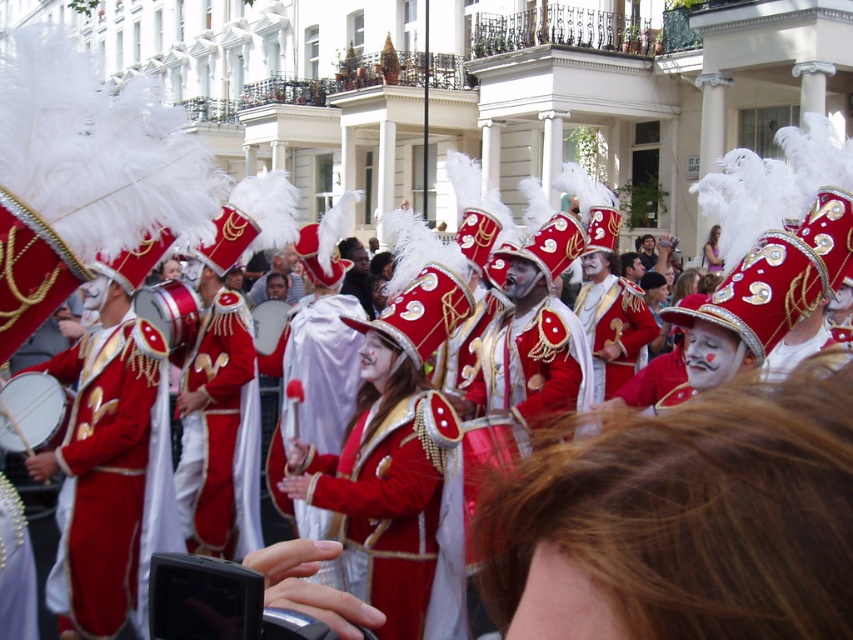
Who is lower down, shiny red coat at center or shiny red fabric at center?

shiny red coat at center

Does point (347, 504) come closer to viewer compared to point (227, 413)?

That is True.

The height and width of the screenshot is (640, 853). In order to click on shiny red coat at center in this screenshot , I will do `click(392, 454)`.

Where is `shiny red fabric at center`? shiny red fabric at center is located at coordinates (219, 433).

Between point (257, 468) and point (714, 260), which one is positioned behind?

The point (714, 260) is behind.

From the picture: Who is more distant from viewer, (247,372) or (712,250)?

The point (712,250) is behind.

Locate an element on the screen. shiny red fabric at center is located at coordinates (219, 433).

Measure the distance between smooth brown hair at center and shiny red coat at center.

smooth brown hair at center and shiny red coat at center are 46.89 feet apart.

Between smooth brown hair at center and shiny red coat at center, which one has more height?

shiny red coat at center

Does point (602, 588) lie behind point (454, 310)?

That is False.

At what (x,y) coordinates should I click in order to perform the action: click on smooth brown hair at center. Please return your answer as a coordinate pair (x, y). The width and height of the screenshot is (853, 640). Looking at the image, I should click on (685, 518).